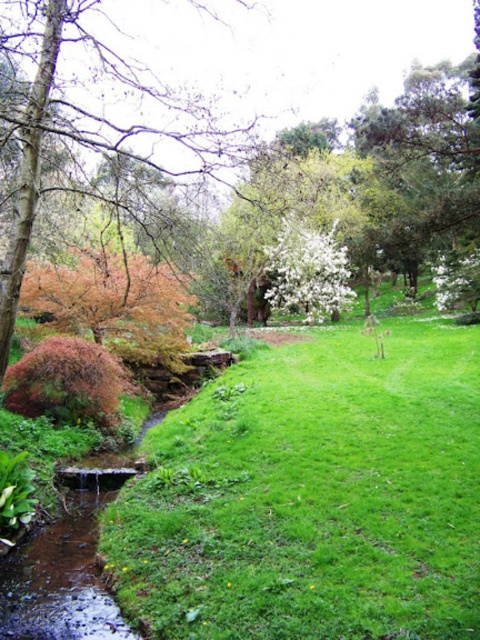
Can you confirm if orange-brown bark tree at left is positioned below green textured tree at upper right?

Indeed, orange-brown bark tree at left is positioned under green textured tree at upper right.

Is orange-brown bark tree at left positioned behind green textured tree at upper right?

No, orange-brown bark tree at left is in front of green textured tree at upper right.

Where is `orange-brown bark tree at left`? orange-brown bark tree at left is located at coordinates (94, 122).